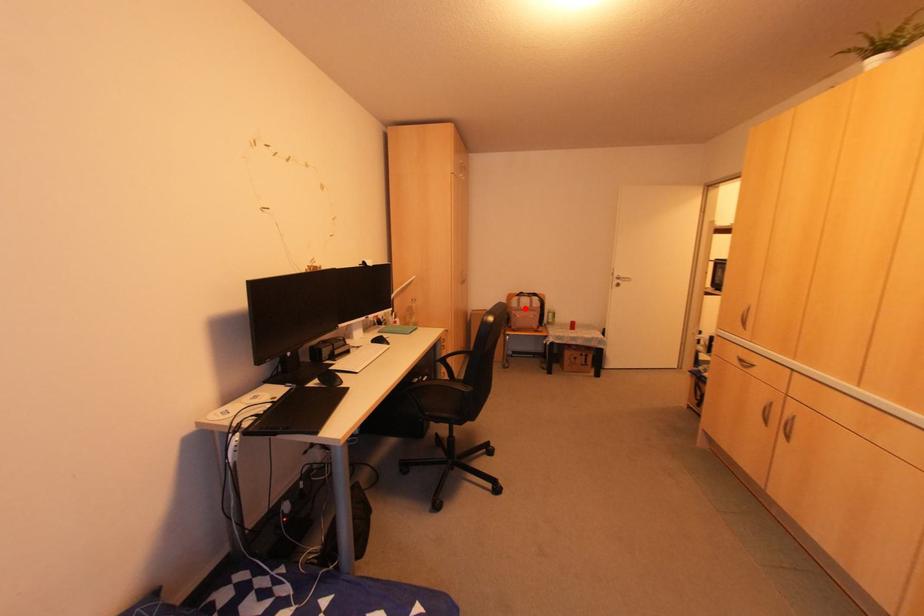
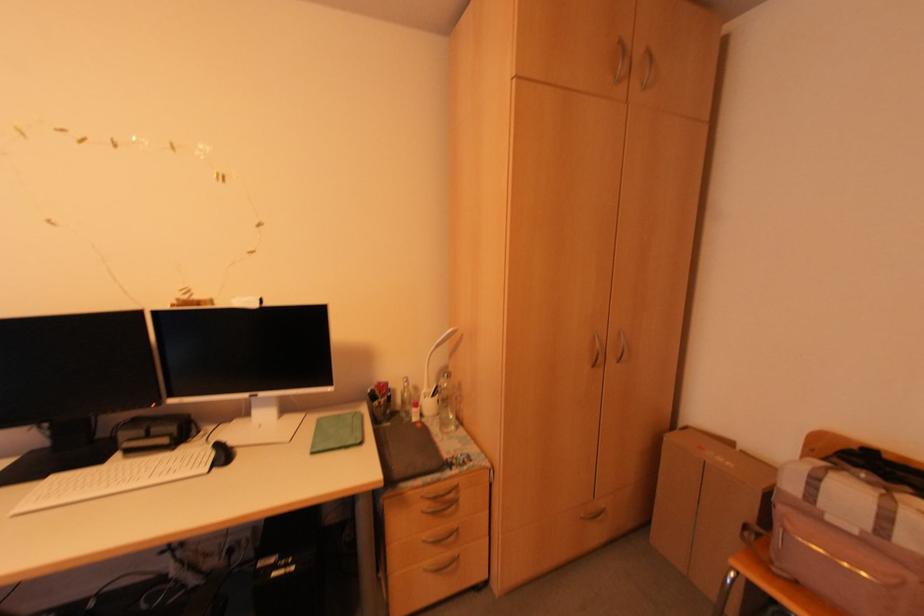
Question: I am providing you with two images of the same scene from different viewpoints. A red point is shown in image1. For the corresponding object point in image2, is it positioned nearer or farther from the camera?

Choices:
 (A) Nearer
 (B) Farther

Answer: (A)